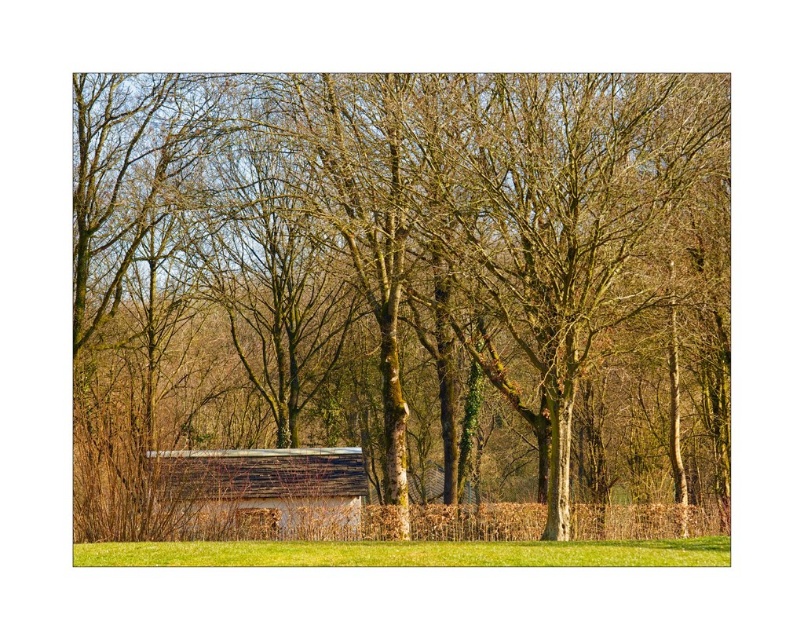
Is point (536, 502) more distant than point (642, 564)?

Yes, it is behind point (642, 564).

The height and width of the screenshot is (640, 804). What are the coordinates of `brown bark tree at center` in the screenshot? It's located at (402, 305).

You are a GUI agent. You are given a task and a screenshot of the screen. Output one action in this format:
    pyautogui.click(x=<x>, y=<y>)
    Task: Click on the brown bark tree at center
    The image size is (804, 640).
    Given the screenshot: What is the action you would take?
    pyautogui.click(x=402, y=305)

Who is more distant from viewer, (452, 180) or (253, 496)?

The point (253, 496) is more distant.

Is brown bark tree at center positioned in front of wooden hut at center?

Answer: That is True.

Between point (321, 458) and point (156, 451), which one is positioned in front?

Point (156, 451) is in front.

The height and width of the screenshot is (640, 804). I want to click on brown bark tree at center, so click(402, 305).

Who is more distant from viewer, (x=212, y=499) or (x=696, y=557)?

Point (x=212, y=499)

Is point (260, 525) farther from viewer compared to point (232, 547)?

That is True.

The width and height of the screenshot is (804, 640). I want to click on wooden hut at center, so click(265, 490).